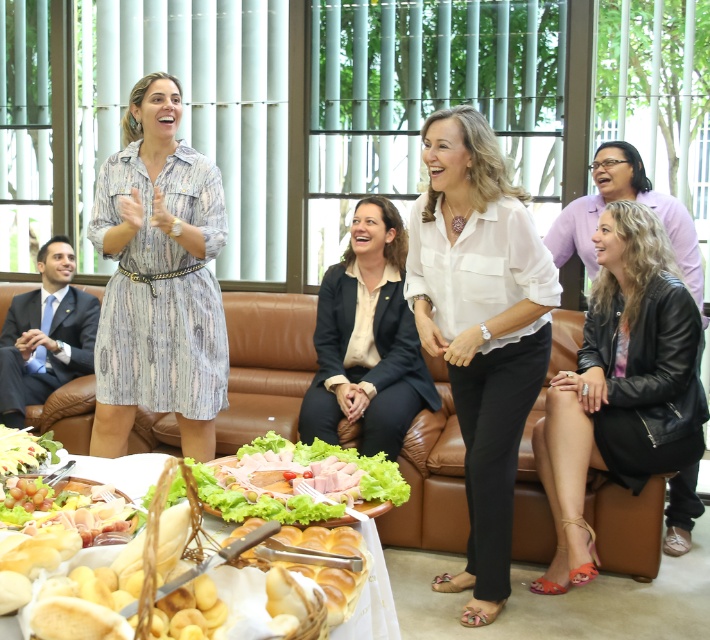
Question: Considering the relative positions of white satin blouse at center and black leather jacket at lower right in the image provided, where is white satin blouse at center located with respect to black leather jacket at lower right?

Choices:
 (A) above
 (B) below

Answer: (A)

Question: Based on their relative distances, which object is nearer to the white satin blouse at center?

Choices:
 (A) white bread at lower center
 (B) green leafy lettuce at lower center

Answer: (B)

Question: Which point is closer to the camera?

Choices:
 (A) (337, 579)
 (B) (398, 291)
 (C) (6, 291)
 (D) (18, 456)

Answer: (A)

Question: Observing the image, what is the correct spatial positioning of brown leather couch at center in reference to white glossy bread at lower left?

Choices:
 (A) below
 (B) above

Answer: (B)

Question: Which object appears closest to the camera in this image?

Choices:
 (A) white glossy bread at lower left
 (B) matte black blazer at center

Answer: (A)

Question: In this image, where is white glossy bread at lower left located relative to green leafy lettuce at lower center?

Choices:
 (A) above
 (B) below

Answer: (B)